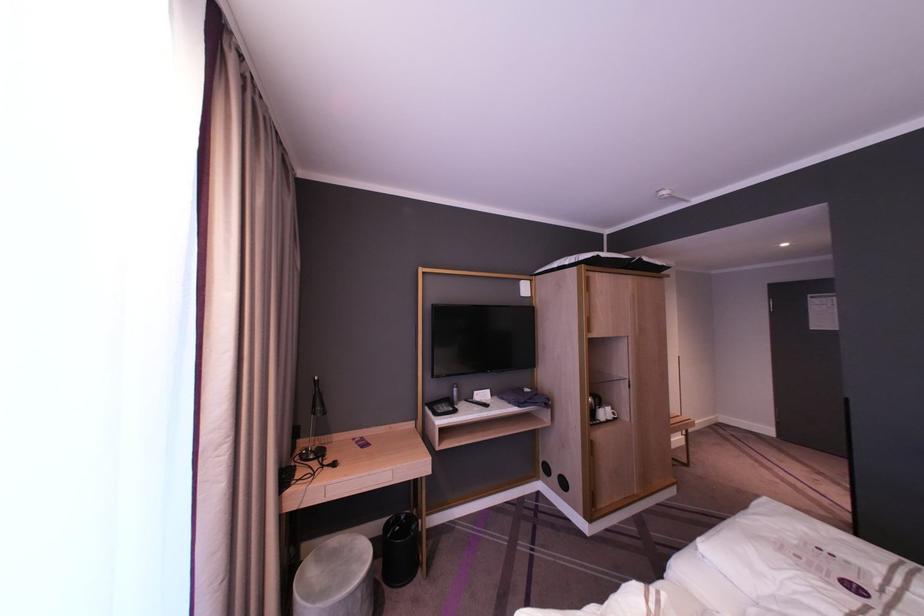
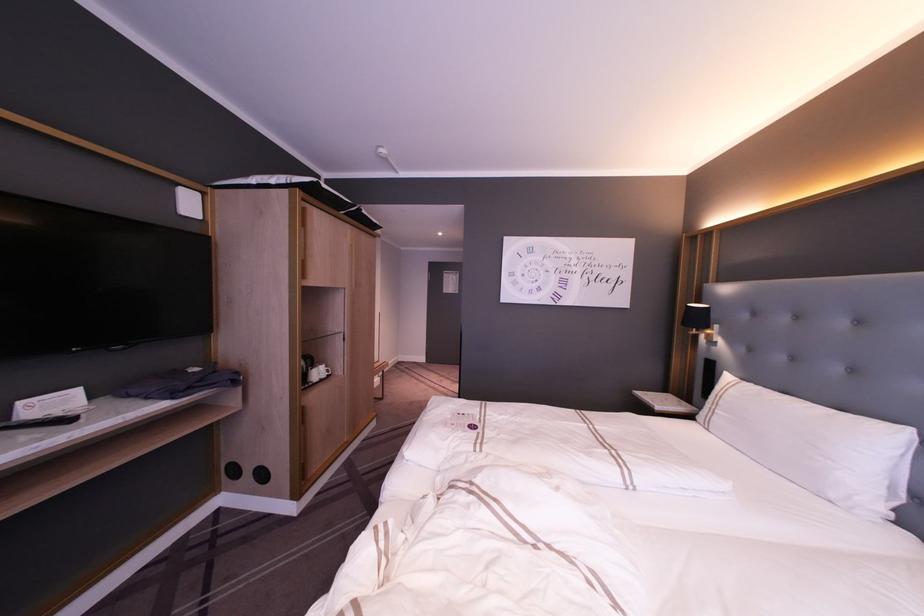
Question: The camera is either moving clockwise (left) or counter-clockwise (right) around the object. The first image is from the beginning of the video and the second image is from the end. Is the camera moving left or right when shooting the video?

Choices:
 (A) Left
 (B) Right

Answer: (A)